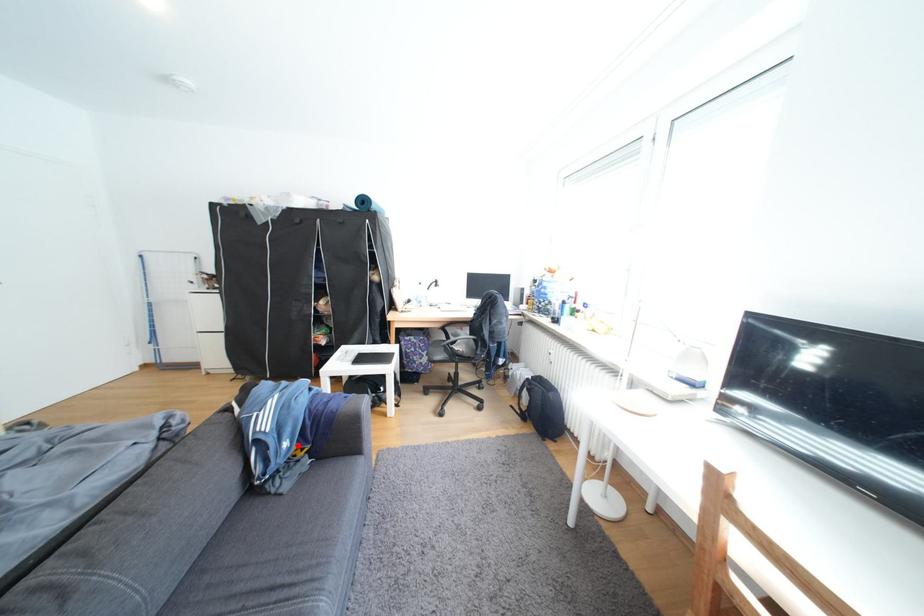
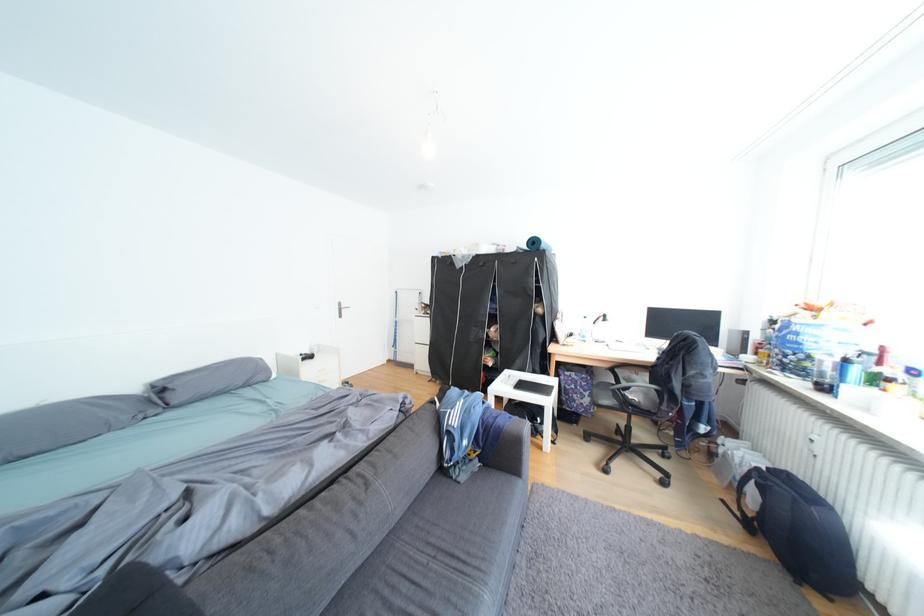
Question: I am providing you with two images of the same scene from different viewpoints. Given a red point in image1, look at the same physical point in image2. Is it:

Choices:
 (A) Closer to the viewpoint
 (B) Farther from the viewpoint

Answer: (B)